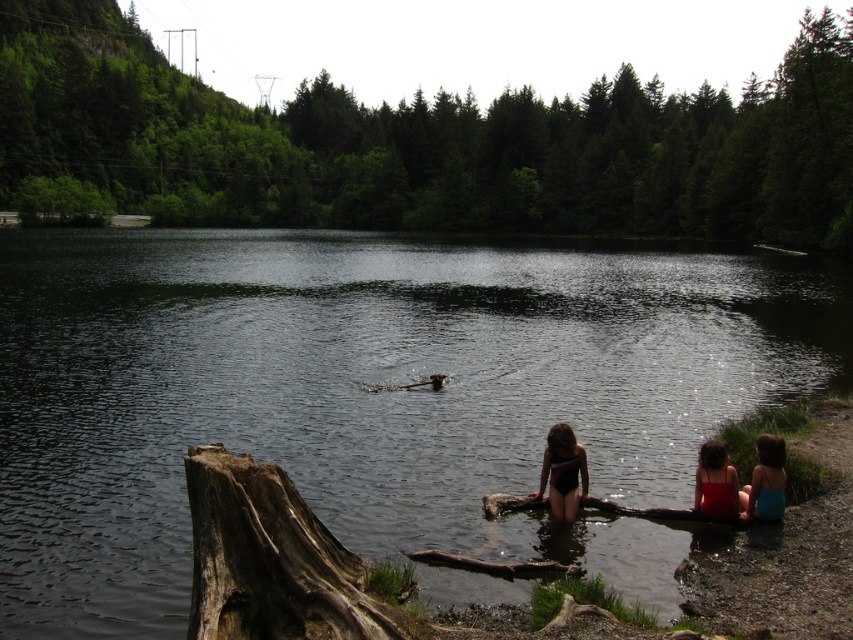
Who is positioned more to the right, blue fabric swimsuits at lower right or red fabric swimsuit at lower right?

From the viewer's perspective, blue fabric swimsuits at lower right appears more on the right side.

Is blue fabric swimsuits at lower right shorter than red fabric swimsuit at lower right?

Yes, blue fabric swimsuits at lower right is shorter than red fabric swimsuit at lower right.

Who is more forward, (759, 545) or (712, 440)?

Point (759, 545) is more forward.

This screenshot has width=853, height=640. Find the location of `blue fabric swimsuits at lower right`. blue fabric swimsuits at lower right is located at coordinates (786, 552).

Can you confirm if dark brown rough tree trunk at lower left is positioned above blue fabric swimsuits at lower right?

Indeed, dark brown rough tree trunk at lower left is positioned over blue fabric swimsuits at lower right.

Does dark brown rough tree trunk at lower left have a greater width compared to blue fabric swimsuits at lower right?

Yes, dark brown rough tree trunk at lower left is wider than blue fabric swimsuits at lower right.

Is point (332, 541) closer to viewer compared to point (752, 593)?

No.

The image size is (853, 640). I want to click on dark brown rough tree trunk at lower left, so click(x=270, y=560).

Is black swimsuit at center smaller than blue fabric swimsuit at lower right?

Actually, black swimsuit at center might be larger than blue fabric swimsuit at lower right.

Based on the photo, which of these two, black swimsuit at center or blue fabric swimsuit at lower right, stands shorter?

Standing shorter between the two is blue fabric swimsuit at lower right.

Is point (552, 465) positioned after point (753, 493)?

Yes.

At what (x,y) coordinates should I click in order to perform the action: click on black swimsuit at center. Please return your answer as a coordinate pair (x, y). Looking at the image, I should click on (563, 472).